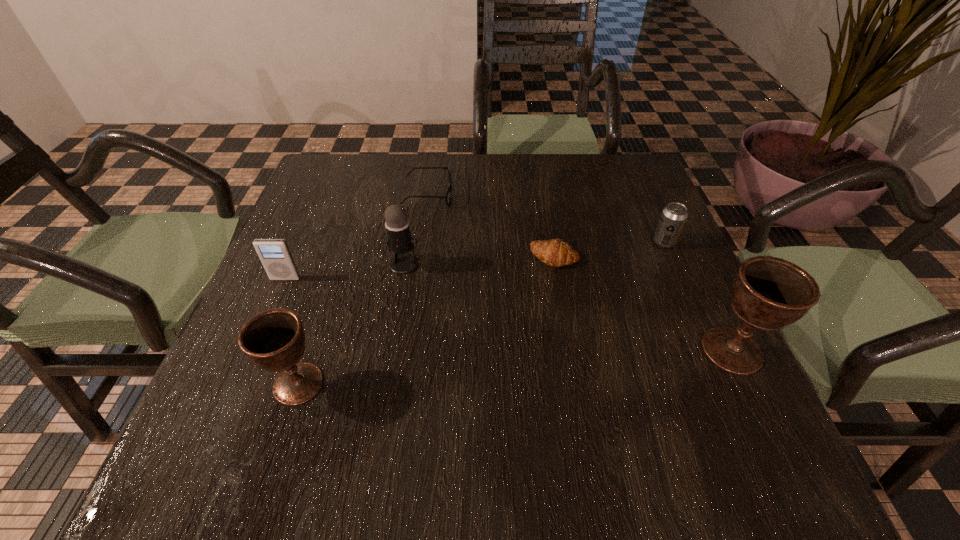
You are a GUI agent. You are given a task and a screenshot of the screen. Output one action in this format:
    pyautogui.click(x=<x>, y=<y>)
    Task: Click on the free space between the crescent roll and the left chalice
    
    Given the screenshot: What is the action you would take?
    pyautogui.click(x=426, y=320)

You are a GUI agent. You are given a task and a screenshot of the screen. Output one action in this format:
    pyautogui.click(x=<x>, y=<y>)
    Task: Click on the vacant area that lies between the spectacles and the shorter chalice
    The width and height of the screenshot is (960, 540).
    Given the screenshot: What is the action you would take?
    pyautogui.click(x=363, y=289)

The height and width of the screenshot is (540, 960). I want to click on free space between the third nearest object and the crescent roll, so (420, 267).

This screenshot has height=540, width=960. Identify the location of free space between the farthest object and the sixth object from right to left. (363, 289).

What are the coordinates of `vacant space that's between the fifth farthest object and the spectacles` in the screenshot? It's located at (357, 237).

The width and height of the screenshot is (960, 540). I want to click on vacant area that lies between the beer can and the right chalice, so click(x=698, y=296).

Locate an element on the screen. object that is the fifth closest to the left chalice is located at coordinates (768, 293).

Locate which object ranks third in proximity to the microphone. Please provide its 2D coordinates. Your answer should be formatted as a tuple, i.e. [(x, y)], where the tuple contains the x and y coordinates of a point satisfying the conditions above.

[(274, 340)]

You are a GUI agent. You are given a task and a screenshot of the screen. Output one action in this format:
    pyautogui.click(x=<x>, y=<y>)
    Task: Click on the vacant region that satisfies the following two spatial constraints: 1. on the front-facing side of the spectacles; 2. on the front-facing side of the fifth farthest object
    This screenshot has width=960, height=540.
    Given the screenshot: What is the action you would take?
    pyautogui.click(x=417, y=279)

Where is `vacant space that satisfies the following two spatial constraints: 1. on the front side of the microphone; 2. on the right side of the taller chalice`? The image size is (960, 540). vacant space that satisfies the following two spatial constraints: 1. on the front side of the microphone; 2. on the right side of the taller chalice is located at coordinates (390, 350).